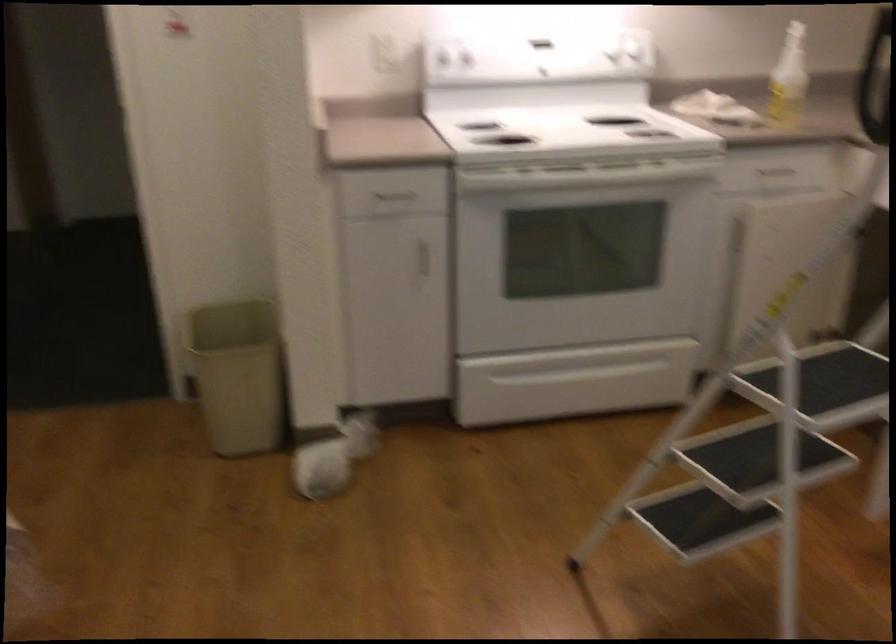
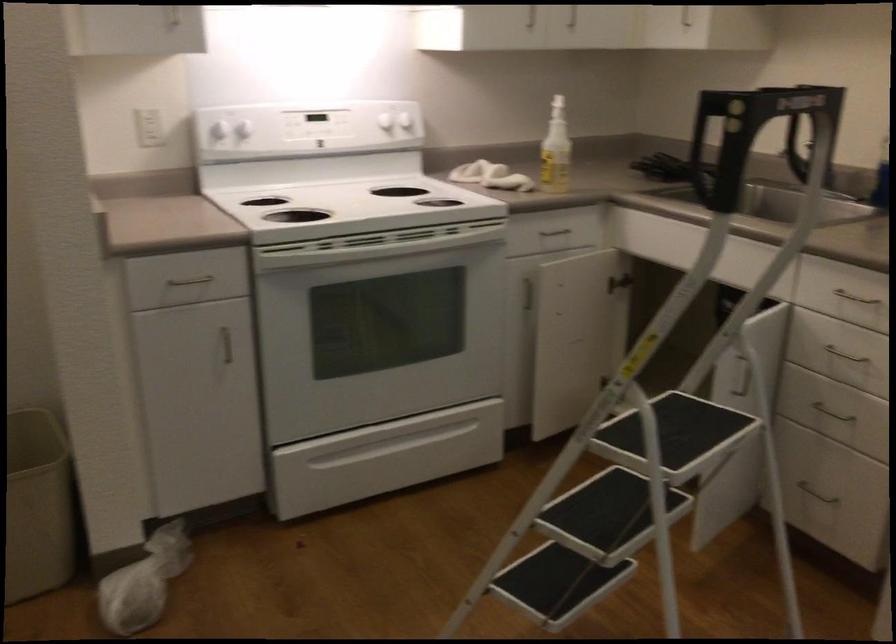
The point at (394,185) is marked in the first image. Where is the corresponding point in the second image?

(191, 272)